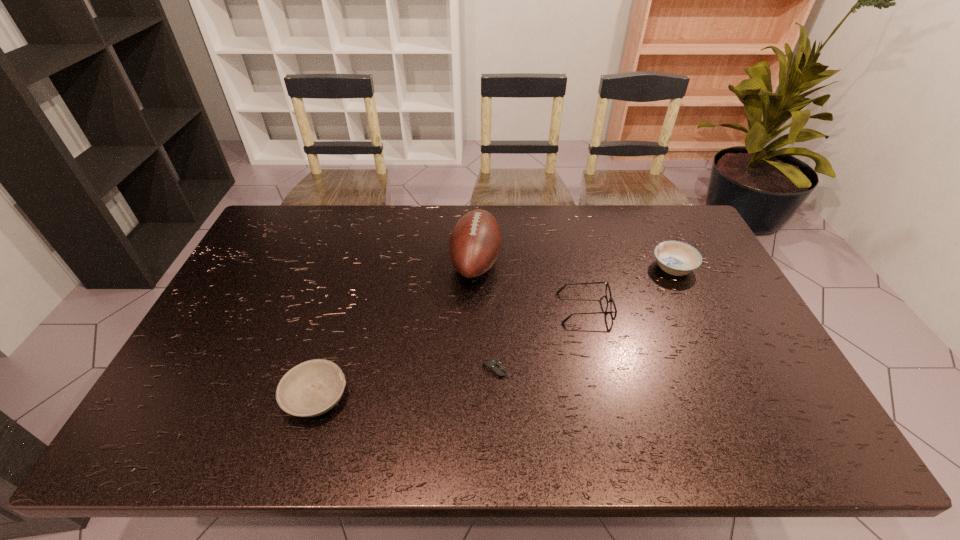
Where is `the tallest object`? The height and width of the screenshot is (540, 960). the tallest object is located at coordinates (475, 242).

This screenshot has width=960, height=540. Find the location of `the rightmost object`. the rightmost object is located at coordinates (677, 258).

Where is `the farther bowl`? This screenshot has width=960, height=540. the farther bowl is located at coordinates (677, 258).

You are a GUI agent. You are given a task and a screenshot of the screen. Output one action in this format:
    pyautogui.click(x=<x>, y=<y>)
    Task: Click on the second object from right to left
    
    Given the screenshot: What is the action you would take?
    pyautogui.click(x=611, y=300)

Where is `the nearer bowl`? The width and height of the screenshot is (960, 540). the nearer bowl is located at coordinates (311, 388).

You are a GUI agent. You are given a task and a screenshot of the screen. Output one action in this format:
    pyautogui.click(x=<x>, y=<y>)
    Task: Click on the shorter bowl
    Image resolution: width=960 pixels, height=540 pixels.
    Given the screenshot: What is the action you would take?
    pyautogui.click(x=311, y=388)

This screenshot has width=960, height=540. What are the coordinates of `computer mouse` in the screenshot? It's located at (492, 365).

Where is `free space located on the front of the tallest object`? This screenshot has width=960, height=540. free space located on the front of the tallest object is located at coordinates (475, 320).

The width and height of the screenshot is (960, 540). I want to click on vacant space located 0.280m on the left of the taller bowl, so pos(563,268).

The height and width of the screenshot is (540, 960). I want to click on vacant area situated with the lenses facing outward on the spectacles, so click(517, 308).